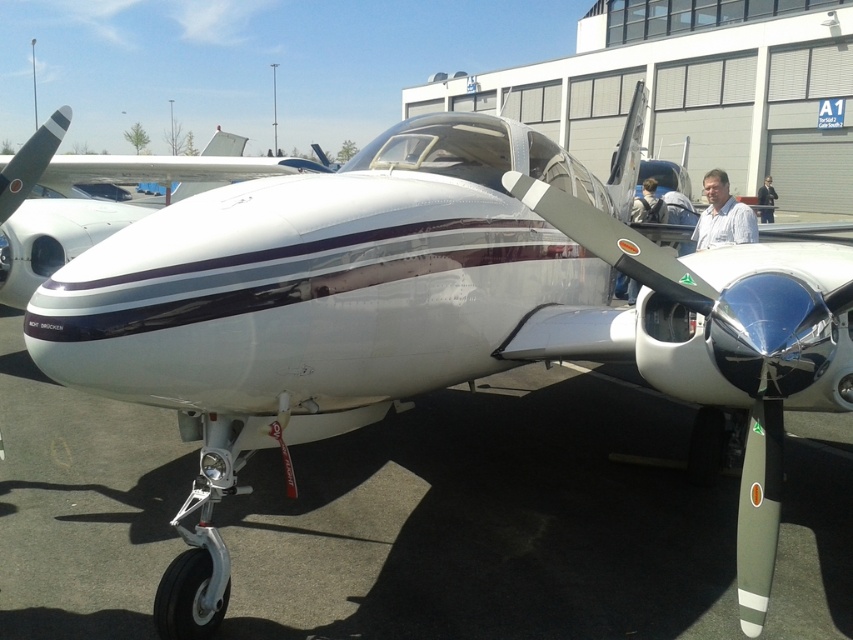
You are a photographer standing in front of the white glossy airplane at center and the polished silver propeller at center. You want to capture a photo that includes both objects. Which object should you position closer to the camera to ensure both fit in the frame?

The polished silver propeller at center is smaller in size compared to the white glossy airplane at center. To ensure both fit in the frame, position the polished silver propeller at center closer to the camera so that its smaller size balances with the airplane in the background.

Looking at this image, you are a pilot standing at the back of the white glossy airplane at center. You want to walk to the polished silver propeller at center. Which direction should you face to walk towards it?

The polished silver propeller at center is positioned on the right side of the white glossy airplane at center. So, you should face towards the right side of the white glossy airplane at center to walk towards the polished silver propeller at center.